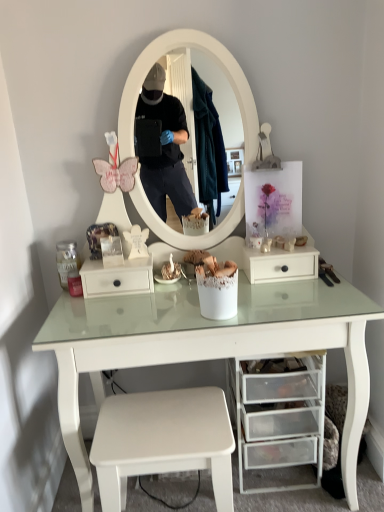
Question: Does transparent plastic drawers at lower center, which is the second drawer from left to right, have a lesser height compared to white matte stool at lower center?

Choices:
 (A) yes
 (B) no

Answer: (B)

Question: From a real-world perspective, is transparent plastic drawers at lower center, which is the second drawer from left to right, on top of white matte stool at lower center?

Choices:
 (A) no
 (B) yes

Answer: (B)

Question: Is transparent plastic drawers at lower center, which is the second drawer from left to right, bigger than white matte stool at lower center?

Choices:
 (A) no
 (B) yes

Answer: (B)

Question: Is transparent plastic drawers at lower center, which ranks as the 1th drawer in bottom-to-top order, positioned beyond the bounds of white matte stool at lower center?

Choices:
 (A) yes
 (B) no

Answer: (A)

Question: Does transparent plastic drawers at lower center, the 1th drawer from the right, appear on the right side of white matte stool at lower center?

Choices:
 (A) yes
 (B) no

Answer: (A)

Question: Is transparent plastic drawers at lower center, the second drawer viewed from the top, at the left side of white matte stool at lower center?

Choices:
 (A) yes
 (B) no

Answer: (B)

Question: Considering the relative sizes of transparent plastic drawers at lower center, the 1th drawer from the right, and white matte drawer at center, which appears as the second drawer when ordered from the bottom, in the image provided, is transparent plastic drawers at lower center, the 1th drawer from the right, wider than white matte drawer at center, which appears as the second drawer when ordered from the bottom,?

Choices:
 (A) no
 (B) yes

Answer: (B)

Question: Can you confirm if transparent plastic drawers at lower center, which ranks as the 1th drawer in bottom-to-top order, is taller than white matte drawer at center, which appears as the second drawer when ordered from the bottom?

Choices:
 (A) no
 (B) yes

Answer: (B)

Question: Is transparent plastic drawers at lower center, which ranks as the 1th drawer in bottom-to-top order, in front of white matte drawer at center, which is counted as the first drawer, starting from the left?

Choices:
 (A) yes
 (B) no

Answer: (A)

Question: Does transparent plastic drawers at lower center, the second drawer viewed from the top, appear on the right side of white matte drawer at center, which appears as the second drawer when ordered from the bottom?

Choices:
 (A) no
 (B) yes

Answer: (B)

Question: Is there a large distance between transparent plastic drawers at lower center, which ranks as the 1th drawer in bottom-to-top order, and white matte drawer at center, which is counted as the first drawer, starting from the left?

Choices:
 (A) no
 (B) yes

Answer: (A)

Question: Is transparent plastic drawers at lower center, the 1th drawer from the right, smaller than white matte drawer at center, which is counted as the first drawer, starting from the left?

Choices:
 (A) yes
 (B) no

Answer: (B)

Question: Is the surface of white matte stool at lower center in direct contact with white matte drawer at center, acting as the first drawer starting from the top?

Choices:
 (A) no
 (B) yes

Answer: (A)